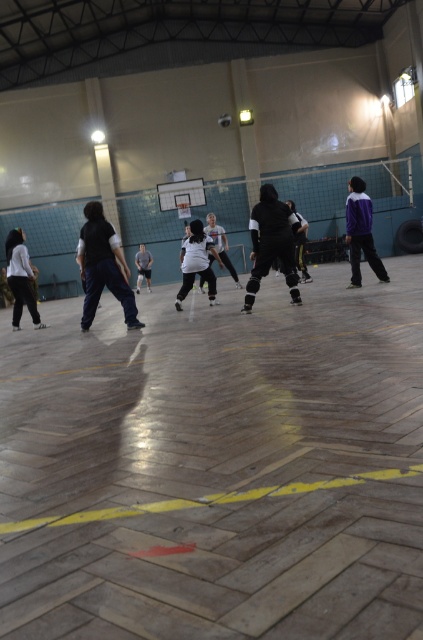
You are a photographer positioned at the back of the sports hall. You want to take a photo of the dark blue pants at center and the purple matte jacket at right without any obstruction. Which object should you focus on first to ensure both are in the frame?

You should focus on the dark blue pants at center first since it is in front of the purple matte jacket at right, ensuring both will be visible in the photo.

You are a photographer trying to capture a shot of the volleyball game. You notice two key players wearing the dark blue pants at center and the purple matte jacket at right. Which player should you focus on to ensure the subject appears larger in your photo?

The dark blue pants at center is bigger than the purple matte jacket at right, so focusing on the player wearing the dark blue pants at center will make the subject appear larger in the photo.